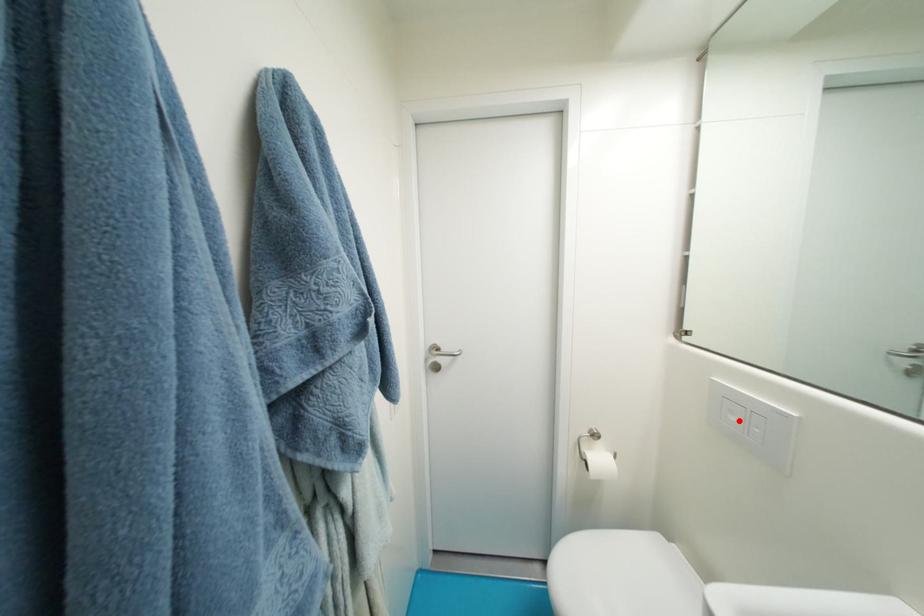
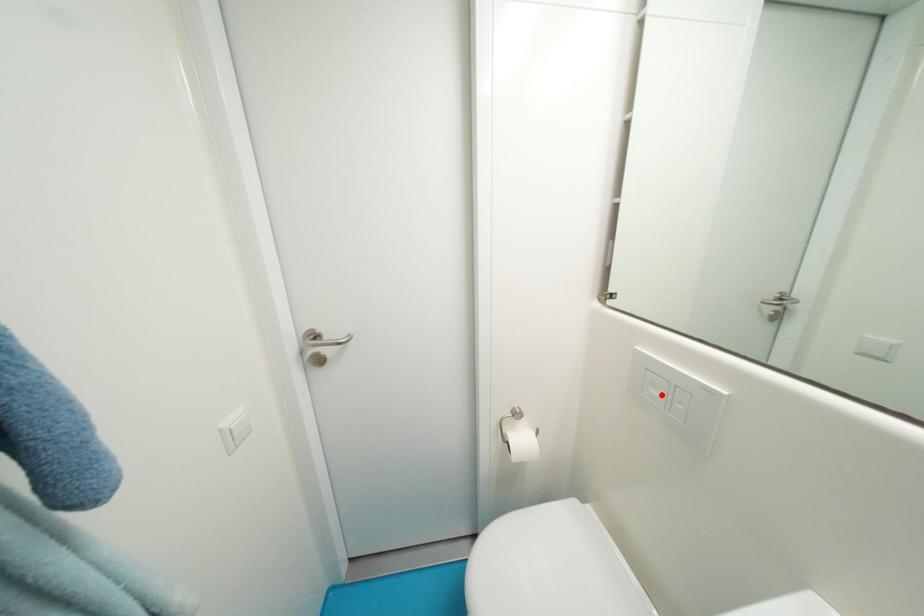
I am providing you with two images of the same scene from different viewpoints. A red point is marked on the first image and another point is marked on the second image. Does the point marked in image1 correspond to the same location as the one in image2?

Yes